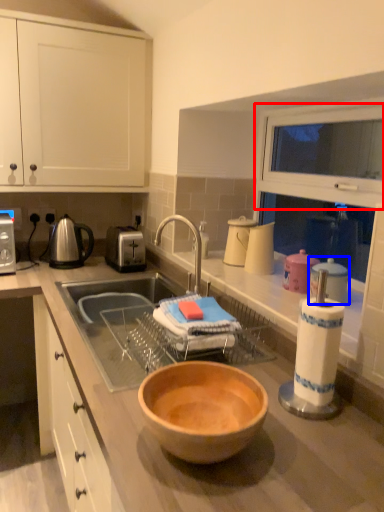
Question: Which object is closer to the camera taking this photo, cabinetry (highlighted by a red box) or appliance (highlighted by a blue box)?

Choices:
 (A) cabinetry
 (B) appliance

Answer: (B)